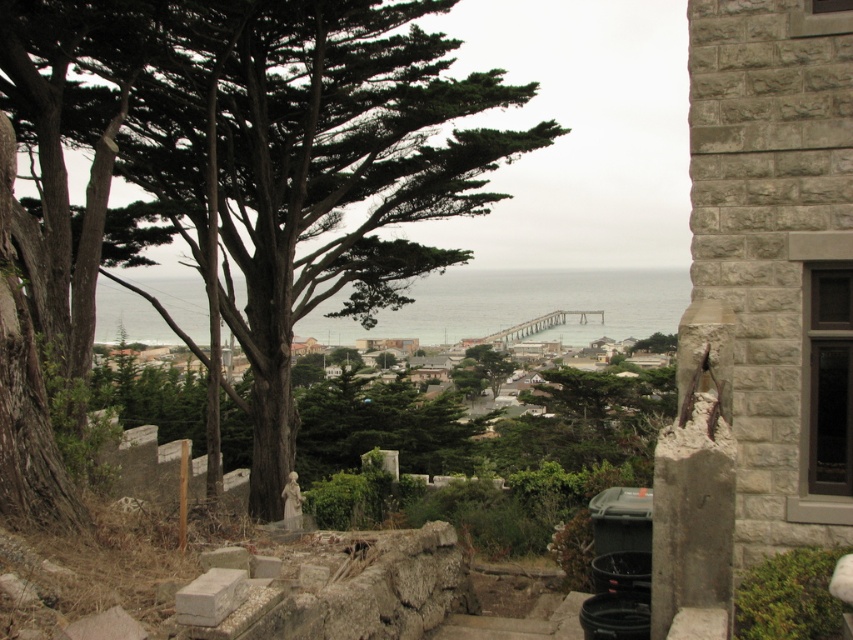
You are standing at the point marked by the coordinates point (254, 156) in the image. What object is located at that exact position?

The point (254, 156) corresponds to the green rough bark tree at center.

From the picture: You are standing at the viewpoint overlooking the coastal town and see two points marked in the scene. Which point, point (x=294, y=125) or point (x=662, y=332), is closer to you?

Point (x=294, y=125) is closer to the viewer than point (x=662, y=332).

Looking at this image, you are standing at the center of the image and want to locate the green rough bark tree at center. According to the coordinates provided, in which direction should you look to find it?

The green rough bark tree at center is located at coordinates point (254, 156), which means it is positioned slightly to the left and upper part of the image from the center. So you should look towards the upper left direction to find it.